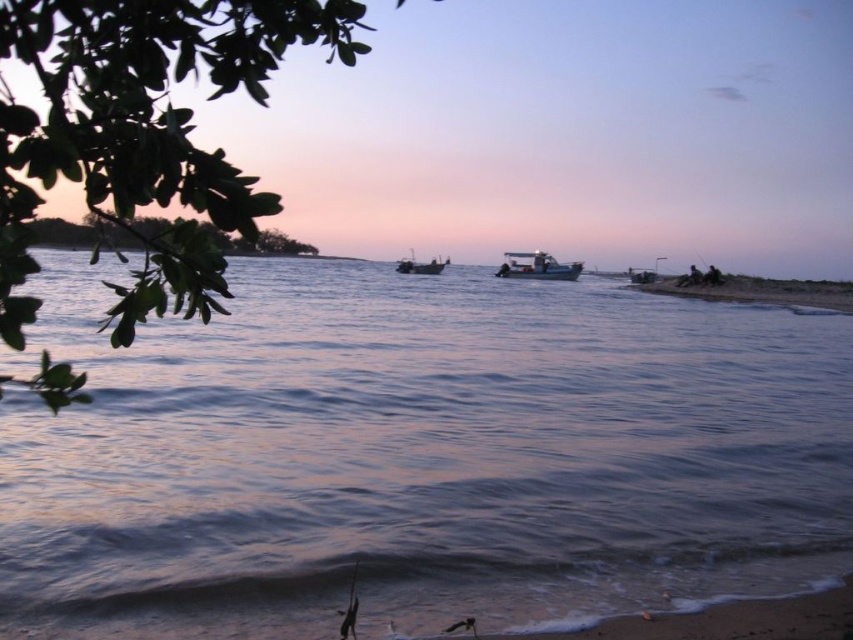
You are standing on the beach and see the smooth water at center and the white plastic boat at center. Which object is nearer to you?

The smooth water at center is closer to the viewer than the white plastic boat at center, so the smooth water at center is nearer to you.

You are standing on the beach and want to walk to the smooth water at center. According to the coordinates provided, in which direction should you walk from your current position?

The smooth water at center is located at coordinates point (418, 456), so you should walk towards the direction of the center of the image to reach it.

You are a photographer planning to capture the reflection of the boats in the water. Since the smooth water at center and the white plastic boat at center are both present, which one would provide a clearer reflection?

The smooth water at center provides a clearer reflection because it is larger in size than the white plastic boat at center, allowing for a more stable surface to reflect the boats.